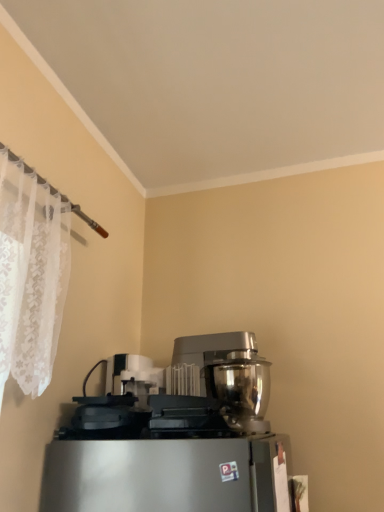
The image size is (384, 512). What do you see at coordinates (230, 375) in the screenshot? I see `satin silver metallic coffee maker at center` at bounding box center [230, 375].

Where is `satin silver metallic coffee maker at center`? Image resolution: width=384 pixels, height=512 pixels. satin silver metallic coffee maker at center is located at coordinates (230, 375).

At what (x,y) coordinates should I click in order to perform the action: click on satin silver metallic coffee maker at center. Please return your answer as a coordinate pair (x, y). Image resolution: width=384 pixels, height=512 pixels. Looking at the image, I should click on click(230, 375).